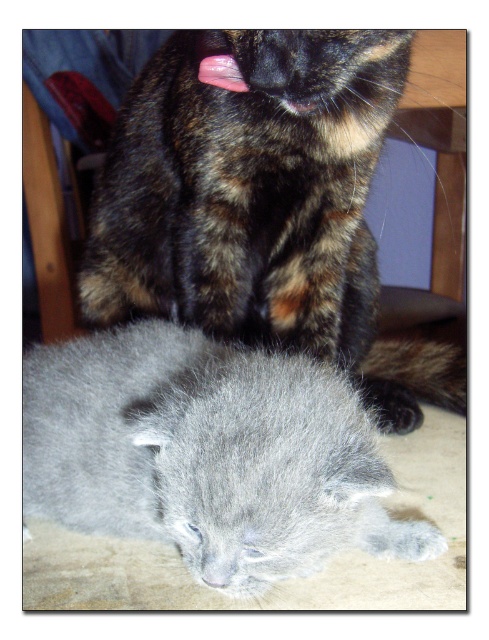
Between fluffy tortoiseshell cat at upper center and gray fluffy kitten at lower center, which one has less height?

Standing shorter between the two is gray fluffy kitten at lower center.

What do you see at coordinates (262, 204) in the screenshot?
I see `fluffy tortoiseshell cat at upper center` at bounding box center [262, 204].

What do you see at coordinates (262, 204) in the screenshot? I see `fluffy tortoiseshell cat at upper center` at bounding box center [262, 204].

At what (x,y) coordinates should I click in order to perform the action: click on fluffy tortoiseshell cat at upper center. Please return your answer as a coordinate pair (x, y). The height and width of the screenshot is (640, 489). Looking at the image, I should click on (262, 204).